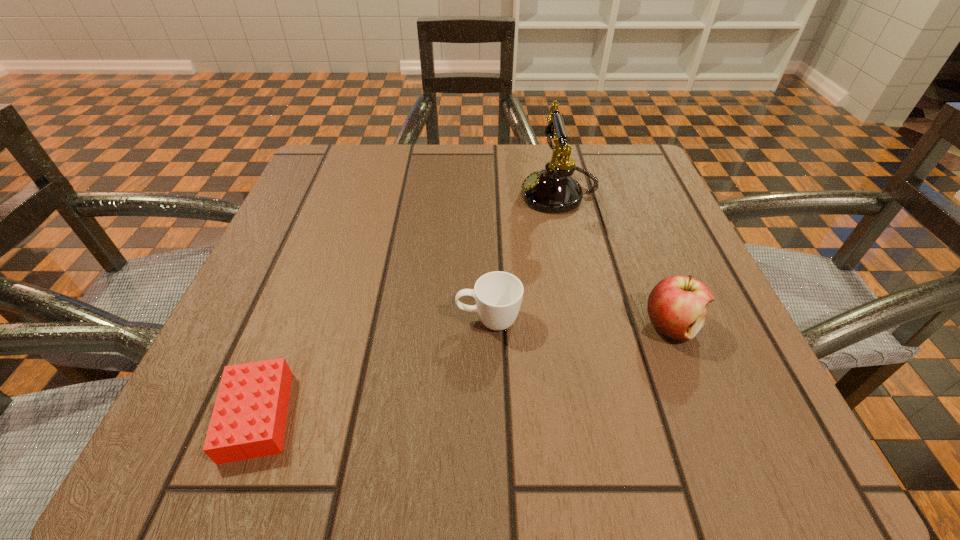
Locate an element on the screen. object that stands as the third closest to the third tallest object is located at coordinates (248, 421).

At what (x,y) coordinates should I click in order to perform the action: click on free space that satisfies the following two spatial constraints: 1. with the handle on the side of the third tallest object; 2. on the back side of the rightmost object. Please return your answer as a coordinate pair (x, y). The width and height of the screenshot is (960, 540). Looking at the image, I should click on (489, 327).

This screenshot has height=540, width=960. Identify the location of vacant point that satisfies the following two spatial constraints: 1. on the dial of the farthest object; 2. on the left side of the third shortest object. (588, 327).

At what (x,y) coordinates should I click in order to perform the action: click on free spot that satisfies the following two spatial constraints: 1. on the dial of the farthest object; 2. on the left side of the second tallest object. Please return your answer as a coordinate pair (x, y). Looking at the image, I should click on (588, 327).

Where is `vacant space that satisfies the following two spatial constraints: 1. on the dial of the farthest object; 2. on the back side of the third shortest object`? vacant space that satisfies the following two spatial constraints: 1. on the dial of the farthest object; 2. on the back side of the third shortest object is located at coordinates (588, 327).

You are a GUI agent. You are given a task and a screenshot of the screen. Output one action in this format:
    pyautogui.click(x=<x>, y=<y>)
    Task: Click on the free location that satisfies the following two spatial constraints: 1. on the back side of the third shortest object; 2. on the right side of the shortest object
    Image resolution: width=960 pixels, height=540 pixels.
    Given the screenshot: What is the action you would take?
    pyautogui.click(x=292, y=327)

I want to click on free space that satisfies the following two spatial constraints: 1. on the dial of the third shortest object; 2. on the left side of the farthest object, so click(x=588, y=327).